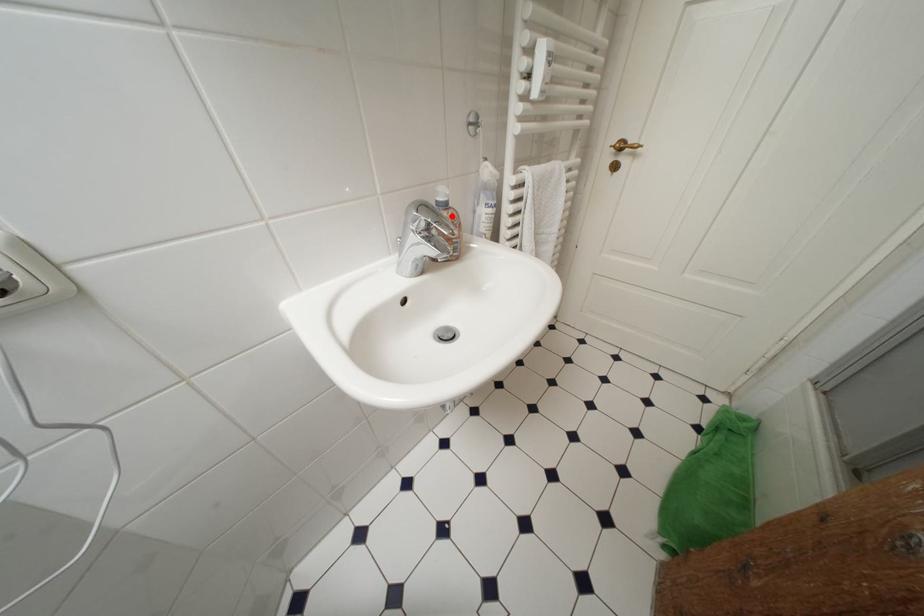
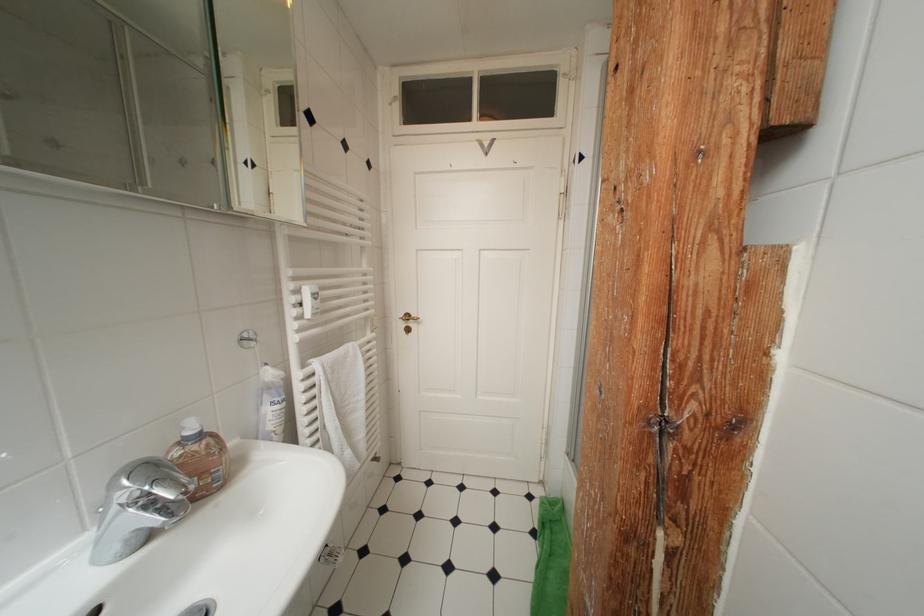
Where in the second image is the point corresponding to the highlighted location from the first image?

(201, 451)